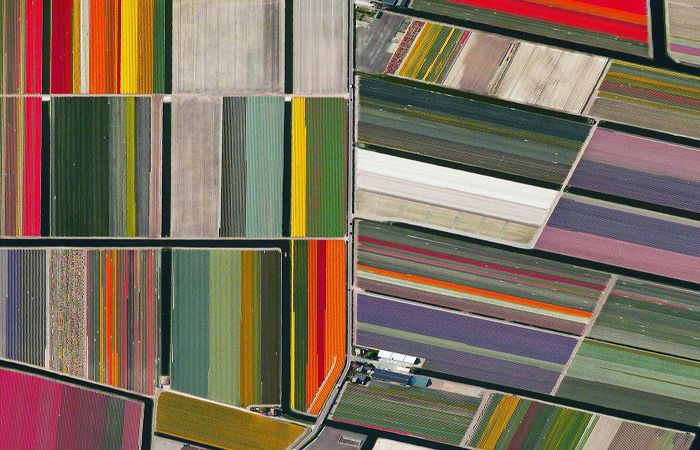
Where is `image of colorful rugs`? The image size is (700, 450). image of colorful rugs is located at coordinates (409, 207).